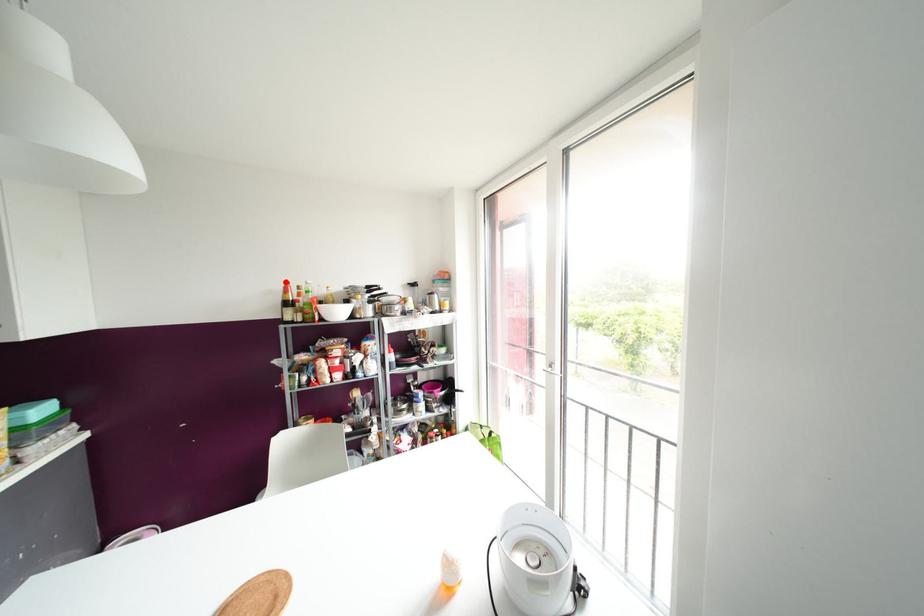
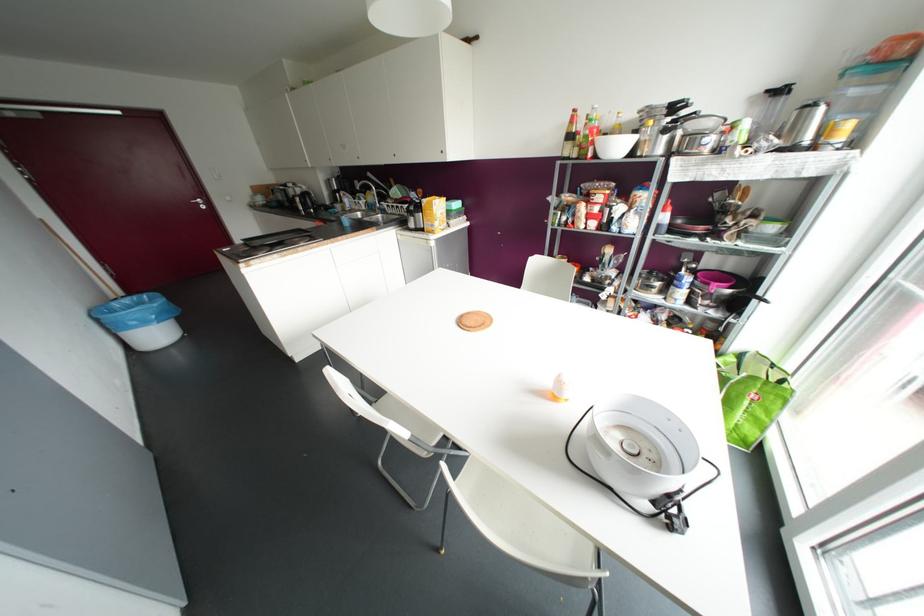
Locate, in the second image, the point that corresponds to the highlighted location in the first image.

(574, 110)